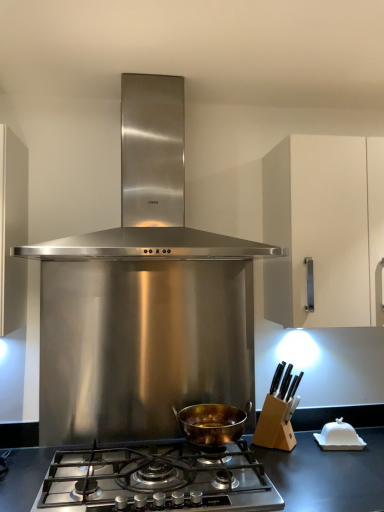
Question: From the image's perspective, is stainless steel range hood at center, which ranks as the first kitchen appliance in top-to-bottom order, located beneath stainless steel gas stove at center?

Choices:
 (A) yes
 (B) no

Answer: (B)

Question: Is stainless steel range hood at center, which ranks as the first kitchen appliance in top-to-bottom order, located outside stainless steel gas stove at center?

Choices:
 (A) no
 (B) yes

Answer: (B)

Question: Can you confirm if stainless steel range hood at center, which ranks as the first kitchen appliance in top-to-bottom order, is taller than stainless steel gas stove at center?

Choices:
 (A) yes
 (B) no

Answer: (A)

Question: Considering the relative sizes of stainless steel range hood at center, which ranks as the first kitchen appliance in top-to-bottom order, and stainless steel gas stove at center in the image provided, is stainless steel range hood at center, which ranks as the first kitchen appliance in top-to-bottom order, smaller than stainless steel gas stove at center?

Choices:
 (A) yes
 (B) no

Answer: (B)

Question: Are stainless steel range hood at center, which ranks as the first kitchen appliance in top-to-bottom order, and stainless steel gas stove at center making contact?

Choices:
 (A) no
 (B) yes

Answer: (A)

Question: Is stainless steel gas stove at center at the back of stainless steel range hood at center, which is counted as the 2th kitchen appliance, starting from the bottom?

Choices:
 (A) no
 (B) yes

Answer: (A)

Question: From a real-world perspective, does stainless steel gas stove at center sit lower than gold-bronze pot at center, which ranks as the second kitchen appliance in top-to-bottom order?

Choices:
 (A) yes
 (B) no

Answer: (A)

Question: Is stainless steel gas stove at center oriented towards gold-bronze pot at center, which ranks as the 1th kitchen appliance in bottom-to-top order?

Choices:
 (A) yes
 (B) no

Answer: (B)

Question: Considering the relative positions of stainless steel gas stove at center and gold-bronze pot at center, which ranks as the second kitchen appliance in top-to-bottom order, in the image provided, is stainless steel gas stove at center to the right of gold-bronze pot at center, which ranks as the second kitchen appliance in top-to-bottom order, from the viewer's perspective?

Choices:
 (A) no
 (B) yes

Answer: (A)

Question: From the image's perspective, would you say stainless steel gas stove at center is positioned over gold-bronze pot at center, which ranks as the second kitchen appliance in top-to-bottom order?

Choices:
 (A) yes
 (B) no

Answer: (B)

Question: Considering the relative sizes of stainless steel gas stove at center and gold-bronze pot at center, which ranks as the 1th kitchen appliance in bottom-to-top order, in the image provided, is stainless steel gas stove at center taller than gold-bronze pot at center, which ranks as the 1th kitchen appliance in bottom-to-top order,?

Choices:
 (A) yes
 (B) no

Answer: (B)

Question: Does stainless steel gas stove at center come in front of gold-bronze pot at center, which ranks as the 1th kitchen appliance in bottom-to-top order?

Choices:
 (A) no
 (B) yes

Answer: (B)

Question: Does stainless steel gas stove at center turn towards stainless steel range hood at center, which ranks as the first kitchen appliance in top-to-bottom order?

Choices:
 (A) yes
 (B) no

Answer: (B)